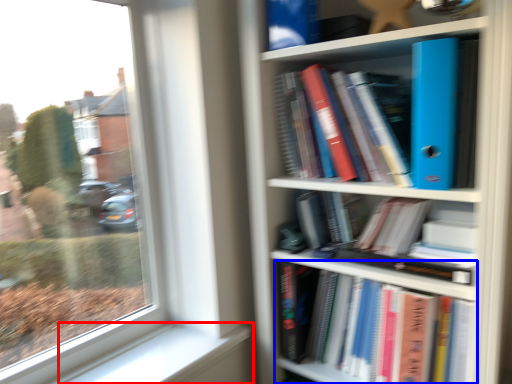
Question: Which object is further to the camera taking this photo, window sill (highlighted by a red box) or book (highlighted by a blue box)?

Choices:
 (A) window sill
 (B) book

Answer: (A)